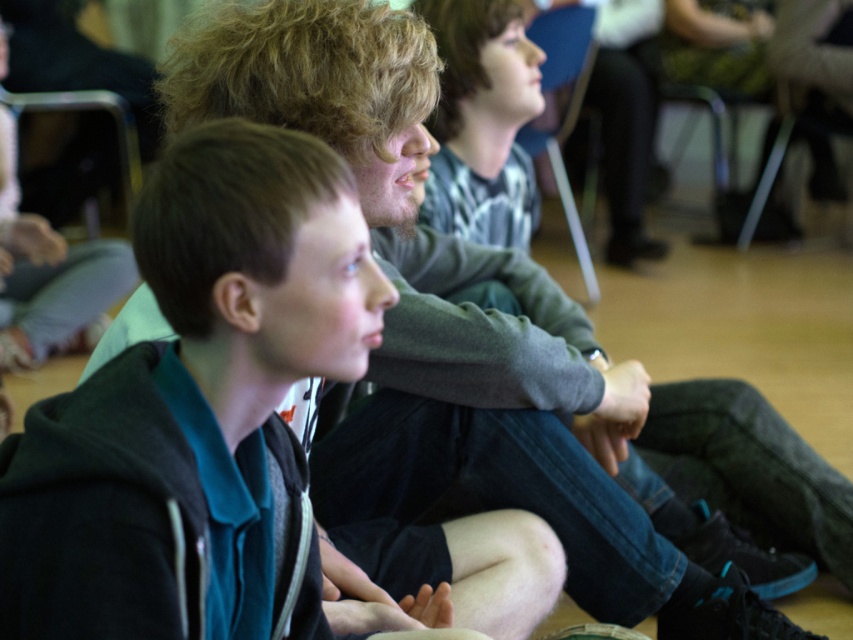
Which is below, black matte hoodie at left or metallic black chair at upper left?

black matte hoodie at left is below.

Does black matte hoodie at left have a greater height compared to metallic black chair at upper left?

Correct, black matte hoodie at left is much taller as metallic black chair at upper left.

At what (x,y) coordinates should I click in order to perform the action: click on black matte hoodie at left. Please return your answer as a coordinate pair (x, y). Looking at the image, I should click on (189, 387).

Does black matte hoodie at left appear under blue fabric chair at upper center?

Yes, black matte hoodie at left is below blue fabric chair at upper center.

Can you confirm if black matte hoodie at left is bigger than blue fabric chair at upper center?

No, black matte hoodie at left is not bigger than blue fabric chair at upper center.

Which is behind, point (35, 612) or point (544, 26)?

Point (544, 26)

Identify the location of black matte hoodie at left. The image size is (853, 640). (189, 387).

Which is below, blue fabric chair at upper center or metallic black chair at upper left?

Positioned lower is blue fabric chair at upper center.

Who is higher up, blue fabric chair at upper center or metallic black chair at upper left?

metallic black chair at upper left

Is point (527, 138) more distant than point (10, 97)?

No, it is in front of (10, 97).

Image resolution: width=853 pixels, height=640 pixels. I want to click on blue fabric chair at upper center, so click(566, 108).